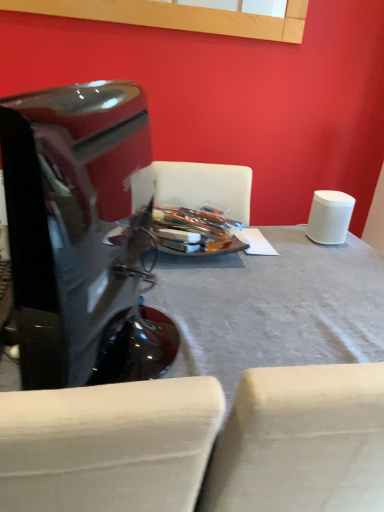
Question: In the image, is glossy black monitor at left positioned in front of or behind white fabric table at center?

Choices:
 (A) behind
 (B) front

Answer: (B)

Question: Is point (132, 89) closer or farther from the camera than point (327, 253)?

Choices:
 (A) farther
 (B) closer

Answer: (A)

Question: From the image's perspective, is glossy black monitor at left above or below white fabric table at center?

Choices:
 (A) below
 (B) above

Answer: (B)

Question: Looking at the image, does white fabric table at center seem bigger or smaller compared to glossy black monitor at left?

Choices:
 (A) small
 (B) big

Answer: (B)

Question: In the image, is white fabric table at center positioned in front of or behind glossy black monitor at left?

Choices:
 (A) front
 (B) behind

Answer: (B)

Question: Considering the positions of white fabric table at center and glossy black monitor at left in the image, is white fabric table at center wider or thinner than glossy black monitor at left?

Choices:
 (A) thin
 (B) wide

Answer: (B)

Question: From the image's perspective, relative to glossy black monitor at left, is white fabric table at center above or below?

Choices:
 (A) above
 (B) below

Answer: (B)